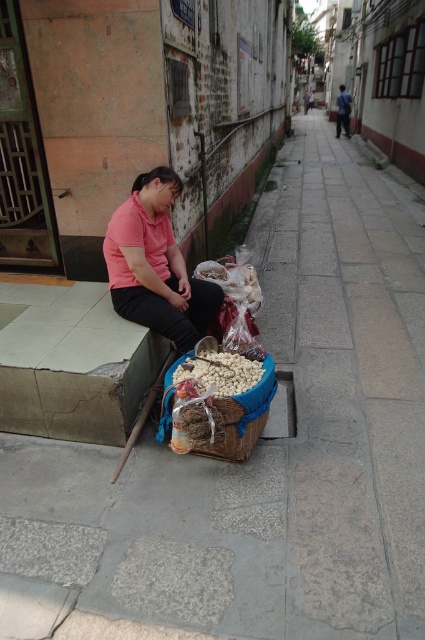
Between white matte nuts at center and matte pink shirt at center, which one appears on the right side from the viewer's perspective?

matte pink shirt at center is more to the right.

Who is higher up, white matte nuts at center or matte pink shirt at center?

matte pink shirt at center

What do you see at coordinates (221, 372) in the screenshot? I see `white matte nuts at center` at bounding box center [221, 372].

Where is `white matte nuts at center`? This screenshot has width=425, height=640. white matte nuts at center is located at coordinates (221, 372).

Between blue woven basket at center and matte pink shirt at center, which one has more height?

With more height is matte pink shirt at center.

Does blue woven basket at center have a greater width compared to matte pink shirt at center?

In fact, blue woven basket at center might be narrower than matte pink shirt at center.

This screenshot has width=425, height=640. What are the coordinates of `blue woven basket at center` in the screenshot? It's located at pos(257,396).

Does pink matte shirt at center lie in front of white matte nuts at center?

No, pink matte shirt at center is further to the viewer.

Can you confirm if pink matte shirt at center is thinner than white matte nuts at center?

No.

Which is in front, point (139, 282) or point (260, 380)?

Positioned in front is point (260, 380).

Identify the location of pink matte shirt at center. (155, 264).